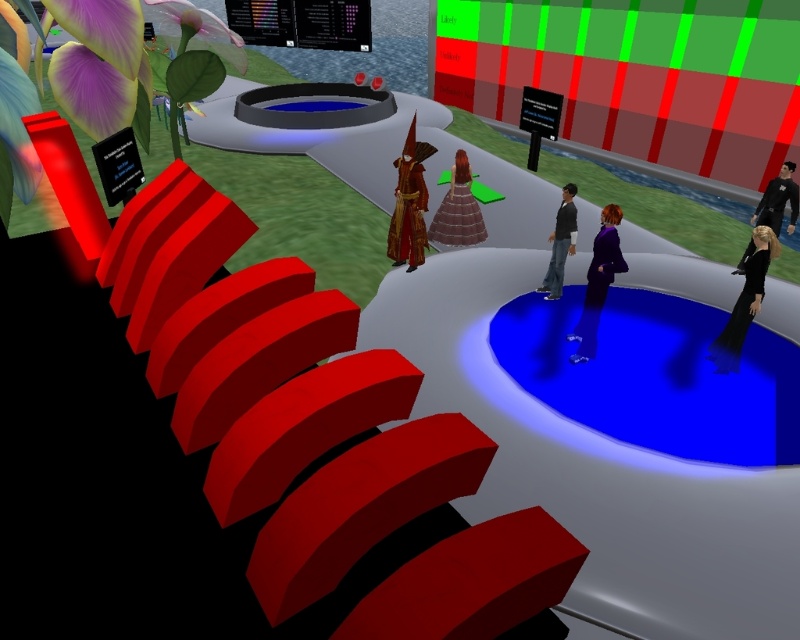
Between blue glossy pool at center and black matte dress at lower right, which one has more height?

With more height is blue glossy pool at center.

Image resolution: width=800 pixels, height=640 pixels. Describe the element at coordinates (656, 376) in the screenshot. I see `blue glossy pool at center` at that location.

What are the coordinates of `blue glossy pool at center` in the screenshot? It's located at (656, 376).

Is point (698, 410) positioned behind point (405, 228)?

That is False.

Which is behind, point (625, 436) or point (408, 195)?

Positioned behind is point (408, 195).

Identify the location of blue glossy pool at center. tap(656, 376).

Can you confirm if purple matte dress at center is bigger than black matte suit at right?

No.

You are a GUI agent. You are given a task and a screenshot of the screen. Output one action in this format:
    pyautogui.click(x=<x>, y=<y>)
    Task: Click on the purple matte dress at center
    This screenshot has height=640, width=800.
    Given the screenshot: What is the action you would take?
    pyautogui.click(x=598, y=282)

Locate an element on the screen. purple matte dress at center is located at coordinates (598, 282).